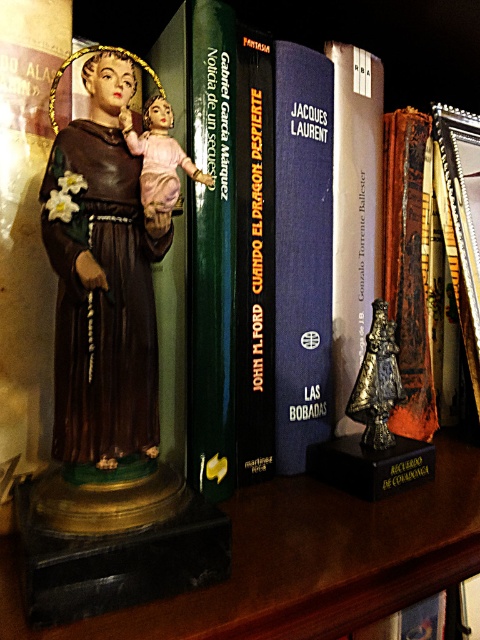
Which of these two, green matte book at center or hardcover book at center, stands shorter?

hardcover book at center

This screenshot has width=480, height=640. I want to click on green matte book at center, so click(x=212, y=252).

Where is `green matte book at center`? The width and height of the screenshot is (480, 640). green matte book at center is located at coordinates (212, 252).

Which of these two, hardcover book at center or shiny bronze bell at center, stands shorter?

shiny bronze bell at center

Where is `hardcover book at center`? The width and height of the screenshot is (480, 640). hardcover book at center is located at coordinates (254, 257).

Is the position of silver metallic bell at center less distant than that of shiny bronze bell at center?

No, silver metallic bell at center is behind shiny bronze bell at center.

Does silver metallic bell at center appear over shiny bronze bell at center?

Indeed, silver metallic bell at center is positioned over shiny bronze bell at center.

The width and height of the screenshot is (480, 640). Find the location of `silver metallic bell at center`. silver metallic bell at center is located at coordinates (355, 212).